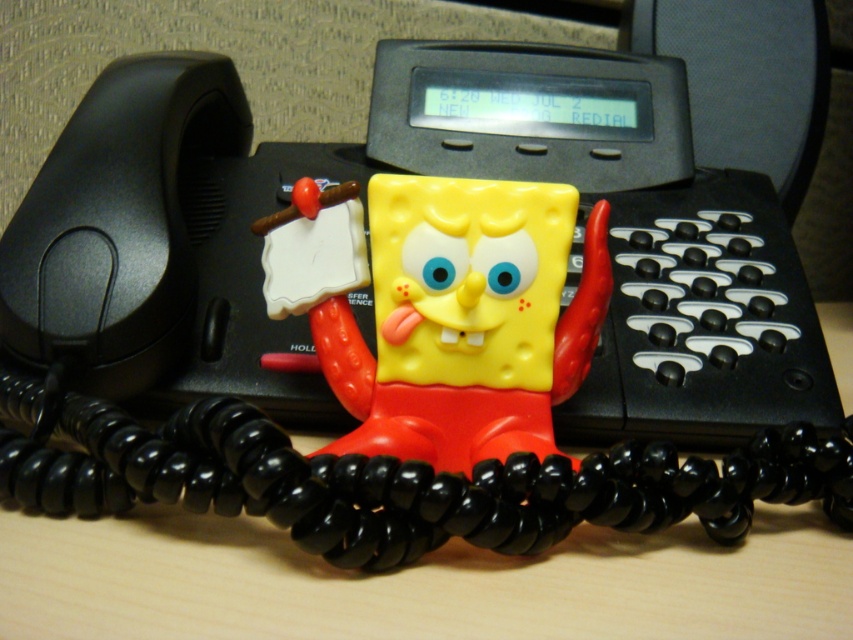
Question: Can you confirm if black plastic phone at center is positioned above yellow matte sponge at center?

Choices:
 (A) yes
 (B) no

Answer: (A)

Question: Which object is closer to the camera taking this photo?

Choices:
 (A) yellow matte sponge at center
 (B) black plastic phone at center

Answer: (A)

Question: Where is black plastic phone at center located in relation to yellow matte sponge at center in the image?

Choices:
 (A) above
 (B) below

Answer: (A)

Question: Can you confirm if black plastic phone at center is thinner than yellow matte sponge at center?

Choices:
 (A) no
 (B) yes

Answer: (A)